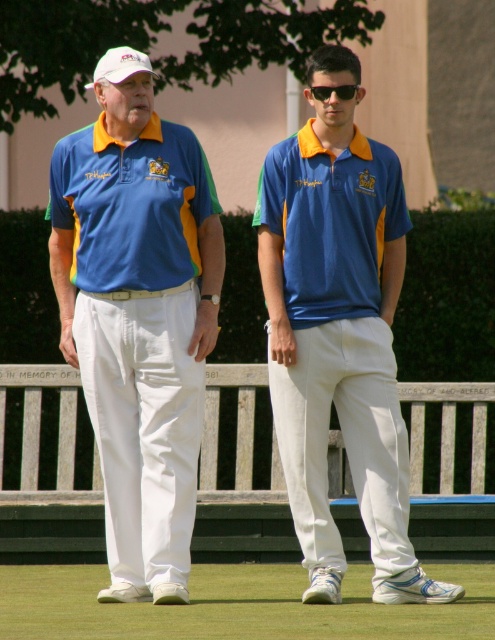
You are a photographer trying to capture a clear shot of the black plastic sunglasses at center. However, the white fabric baseball cap at upper left is blocking your view. Can you move the cap to the side to get an unobstructed view of the sunglasses?

The white fabric baseball cap at upper left is positioned over the black plastic sunglasses at center, so moving the cap to the side would allow an unobstructed view of the sunglasses.

You are a photographer trying to capture both the matte blue polo shirt at left and the matte blue polo shirt at center in a single shot. Since they are at different heights, which one should you focus on first to ensure both are in focus?

The matte blue polo shirt at left is located below the matte blue polo shirt at center. To ensure both are in focus, you should focus on the matte blue polo shirt at center first, as it is higher up and the depth of field will naturally cover the lower one if focused on the higher one.

You are standing at the wooden bench and want to walk to the point that is closer to you. Which point should you walk to, point [295,292] or point [307,237]?

Point [295,292] is in front of point [307,237], so you should walk to point [295,292] because it is closer to you.